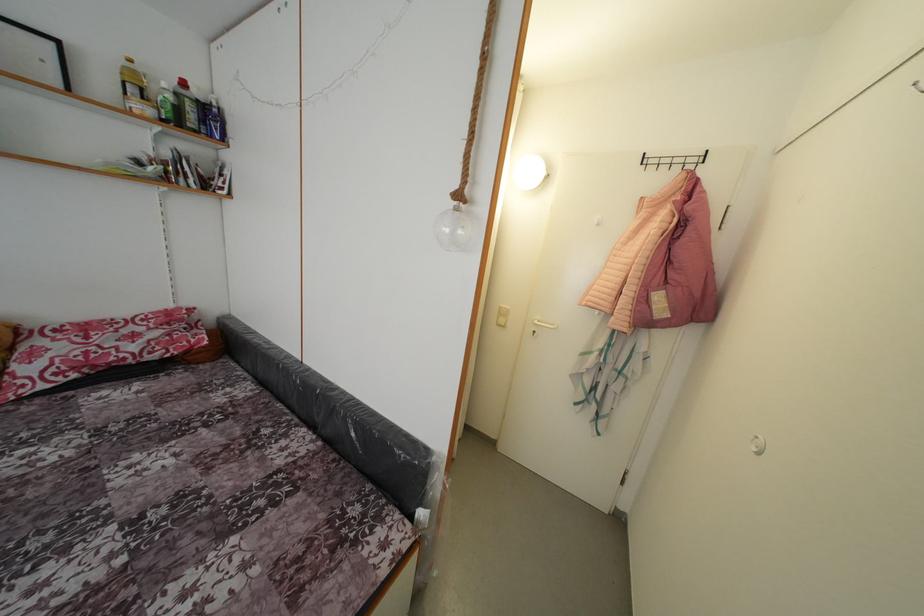
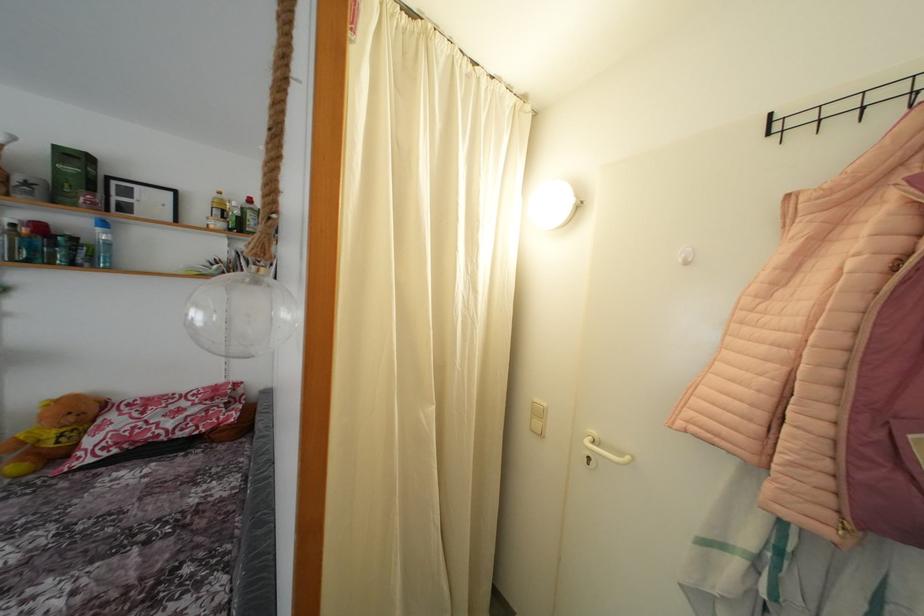
In the second image, find the point that corresponds to point (540, 338) in the first image.

(593, 464)